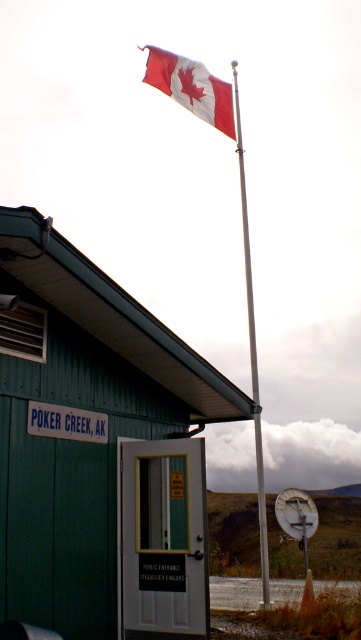
Can you confirm if green wood cabin at center is positioned to the right of red and white fabric flag at upper center?

Correct, you'll find green wood cabin at center to the right of red and white fabric flag at upper center.

Between point (24, 218) and point (151, 45), which one is positioned in front?

Point (24, 218) is more forward.

The height and width of the screenshot is (640, 361). I want to click on green wood cabin at center, so click(80, 420).

Does green wood cabin at center appear over silver metallic flag pole at center?

Incorrect, green wood cabin at center is not positioned above silver metallic flag pole at center.

Is point (64, 506) positioned behind point (259, 493)?

No, it is not.

I want to click on green wood cabin at center, so click(x=80, y=420).

Which of these two, red and white fabric flag at upper center or silver metallic flag pole at center, stands taller?

→ Standing taller between the two is silver metallic flag pole at center.

Which of these two, red and white fabric flag at upper center or silver metallic flag pole at center, stands shorter?

red and white fabric flag at upper center

Does point (206, 86) lie in front of point (244, 228)?

No.

Identify the location of red and white fabric flag at upper center. (192, 88).